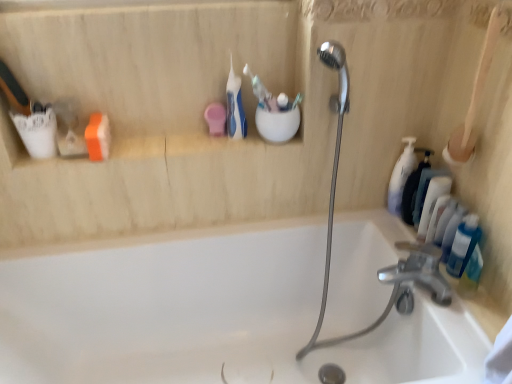
Identify the location of free space in front of translucent plastic bottles at right, arranged as the first toiletry when viewed from the right. The height and width of the screenshot is (384, 512). (463, 317).